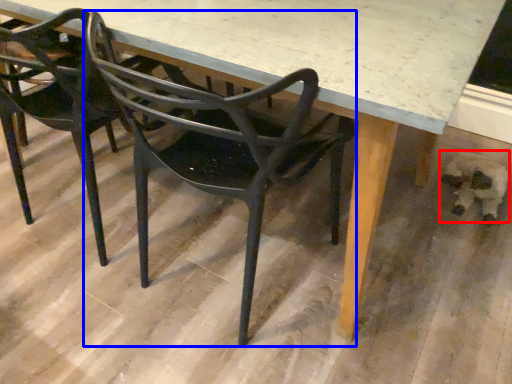
Question: Among these objects, which one is nearest to the camera, animal (highlighted by a red box) or chair (highlighted by a blue box)?

Choices:
 (A) animal
 (B) chair

Answer: (B)